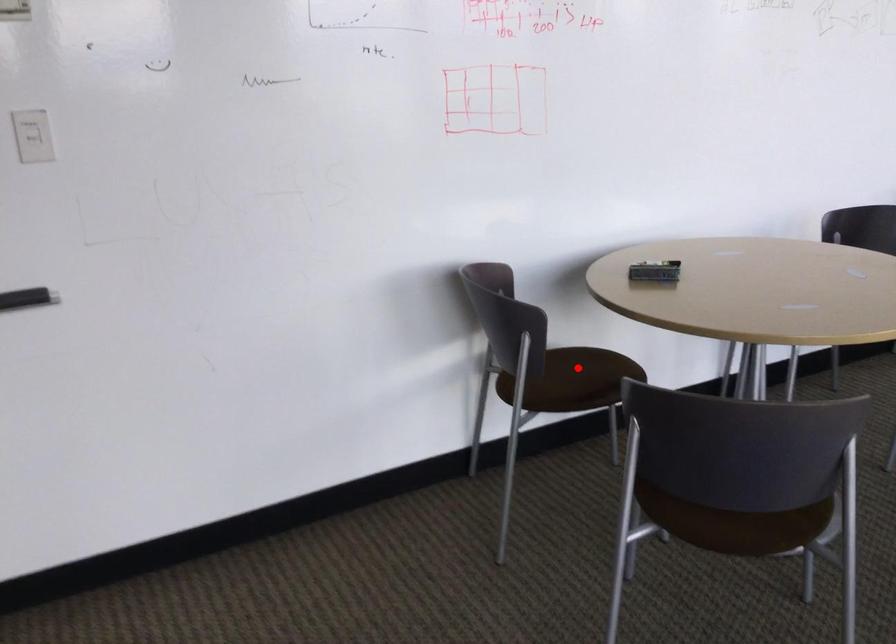
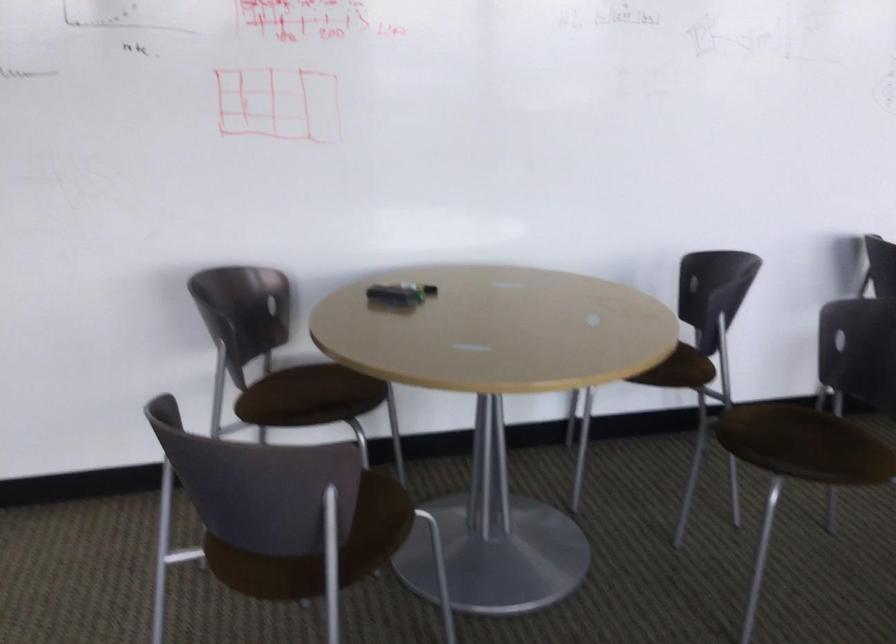
Locate, in the second image, the point that corresponds to the highlighted location in the first image.

(314, 384)